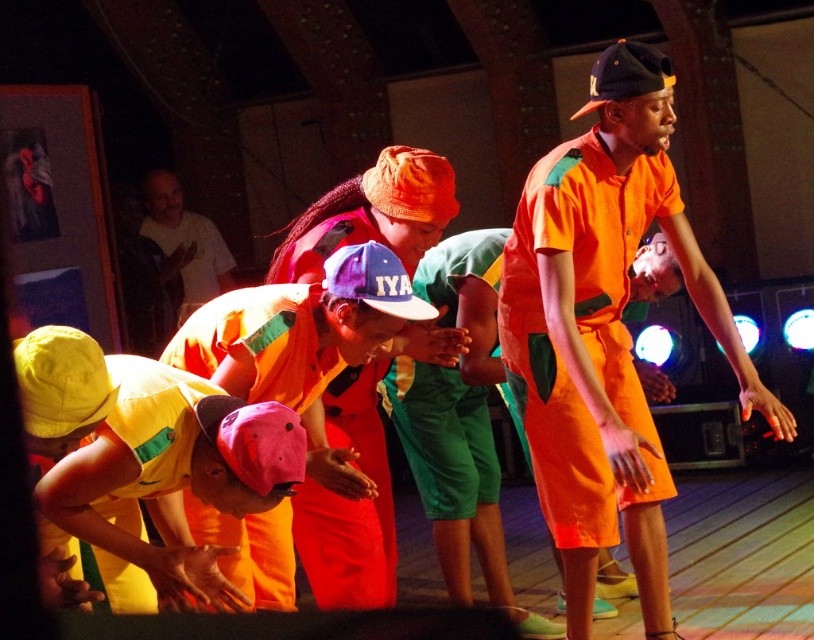
You are standing at the center of the stage and want to move to the orange cotton shirt at lower left. Which direction should you move to reach it?

The orange cotton shirt at lower left is located at point 0.536 in the x coordinate and 0.321 in the y coordinate. Since you are at the center of the stage, moving towards the lower left direction will lead you to the orange cotton shirt at lower left.

You are a photographer setting up for a performance. You need to ensure that the orange cotton jumpsuit at center and the yellow fabric cap at lower left are both visible in your shot. Given their sizes, which object should you focus on first to ensure it fits in the frame?

The orange cotton jumpsuit at center is bigger than the yellow fabric cap at lower left, so you should focus on ensuring the orange cotton jumpsuit at center fits in the frame first since it requires more space.